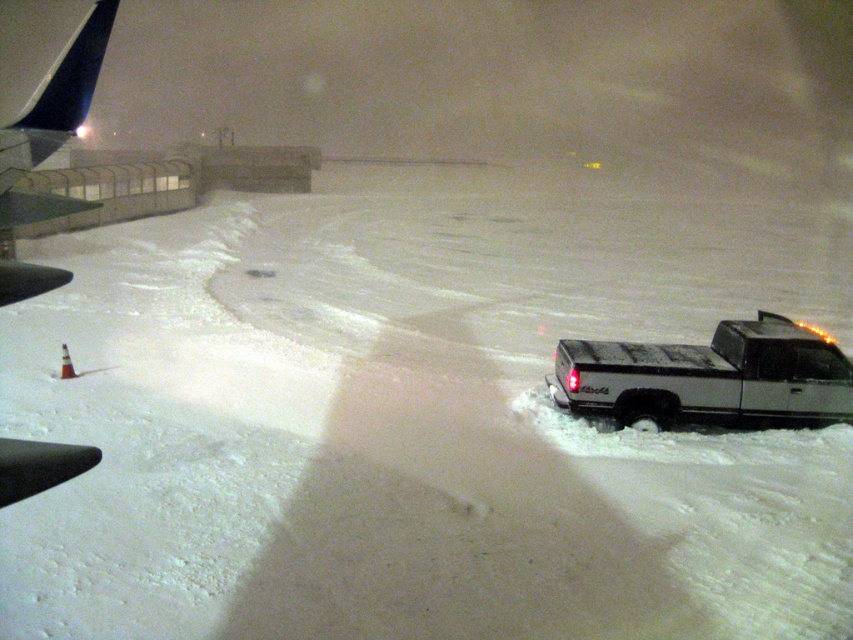
You are a snowplow operator trying to clear the snow around the dark blue metallic airplane wing at upper left. The coordinates given are point (44, 104). Based on the scene description, is this point likely located on the airplane wing or somewhere else?

The point (44, 104) corresponds to the dark blue metallic airplane wing at upper left, so it is located on the airplane wing.

You are a snowplow driver trying to clear the snow from the tarmac. You need to move the silver metallic truck at right and the dark blue metallic airplane wing at upper left. Which object is located to the right of the other?

The silver metallic truck at right is positioned on the right side of the dark blue metallic airplane wing at upper left.